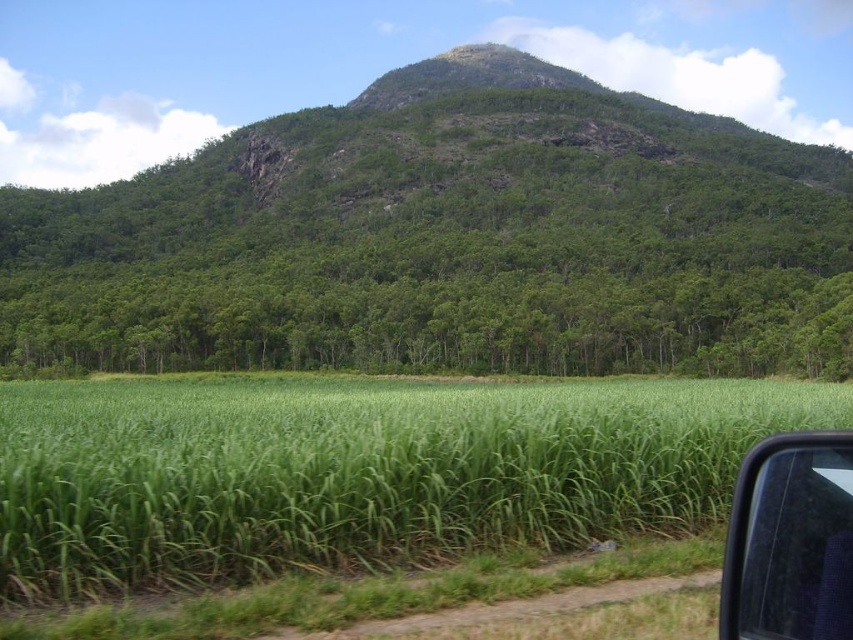
Question: Among these objects, which one is farthest from the camera?

Choices:
 (A) green grassy field at center
 (B) green leafy forest at upper center

Answer: (B)

Question: Is green leafy forest at upper center smaller than transparent glass car window at lower right?

Choices:
 (A) yes
 (B) no

Answer: (B)

Question: Does green leafy forest at upper center appear on the right side of green grassy field at center?

Choices:
 (A) yes
 (B) no

Answer: (B)

Question: Which object is positioned farthest from the transparent glass car window at lower right?

Choices:
 (A) green grassy field at center
 (B) green leafy forest at upper center

Answer: (B)

Question: Which is nearer to the green leafy forest at upper center?

Choices:
 (A) transparent glass car window at lower right
 (B) green grassy field at center

Answer: (B)

Question: Does green leafy forest at upper center come in front of transparent glass car window at lower right?

Choices:
 (A) yes
 (B) no

Answer: (B)